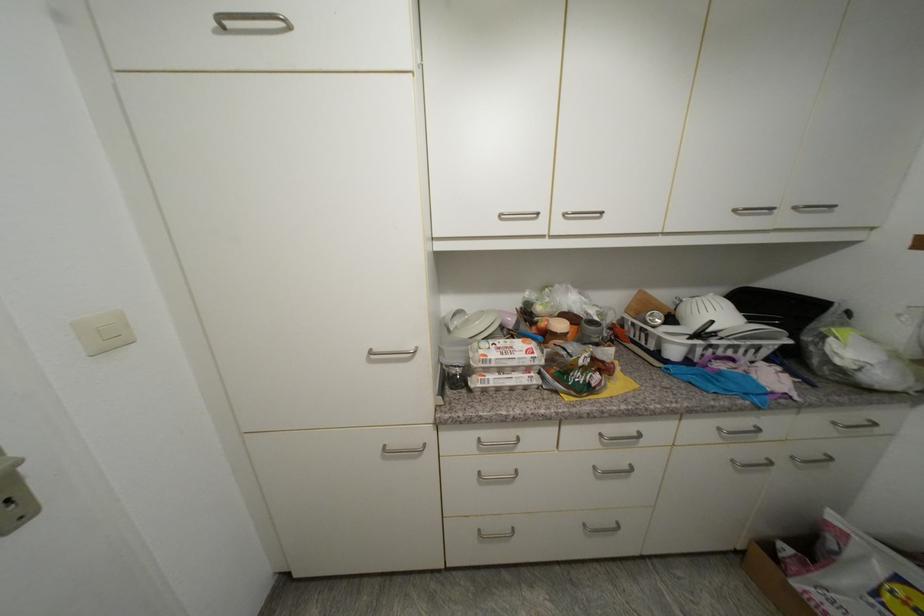
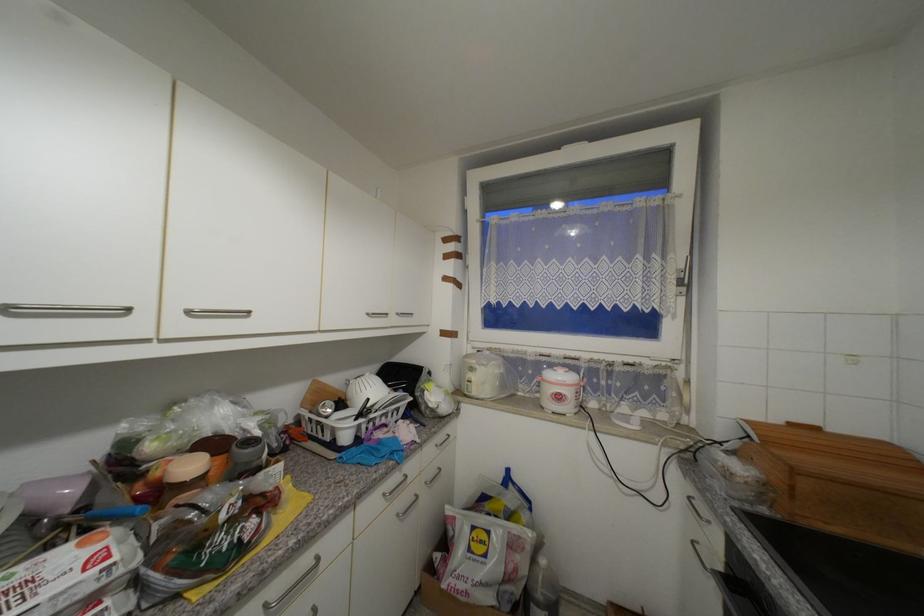
Question: The images are taken continuously from a first-person perspective. In which direction is your viewpoint rotating?

Choices:
 (A) Left
 (B) Right
 (C) Up
 (D) Down

Answer: (B)